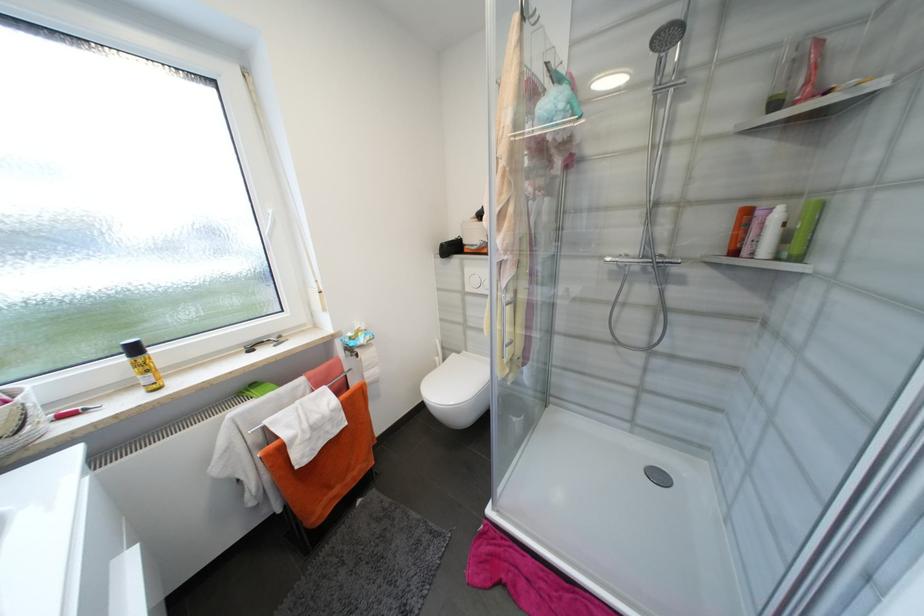
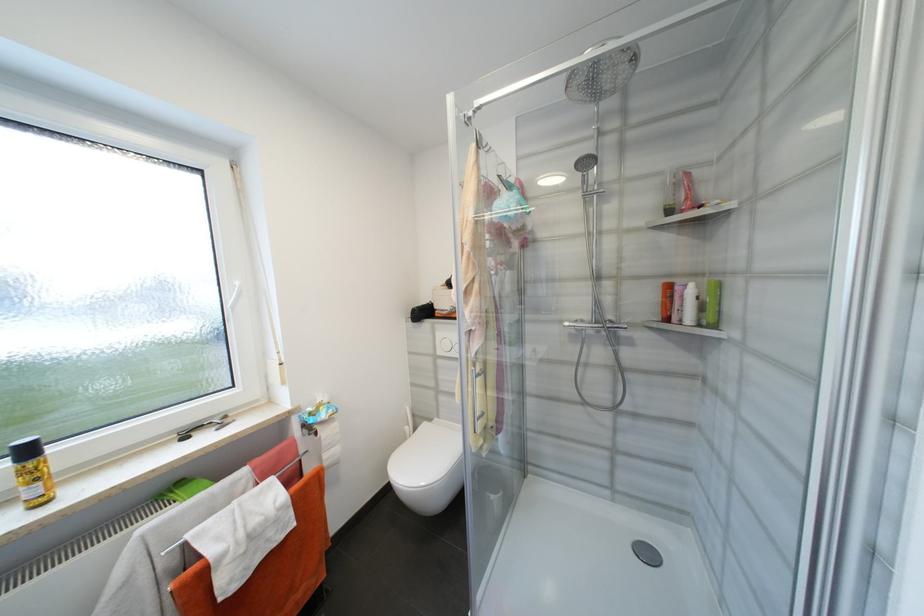
In the second image, find the point that corresponds to pixel 285 341 in the first image.

(228, 422)